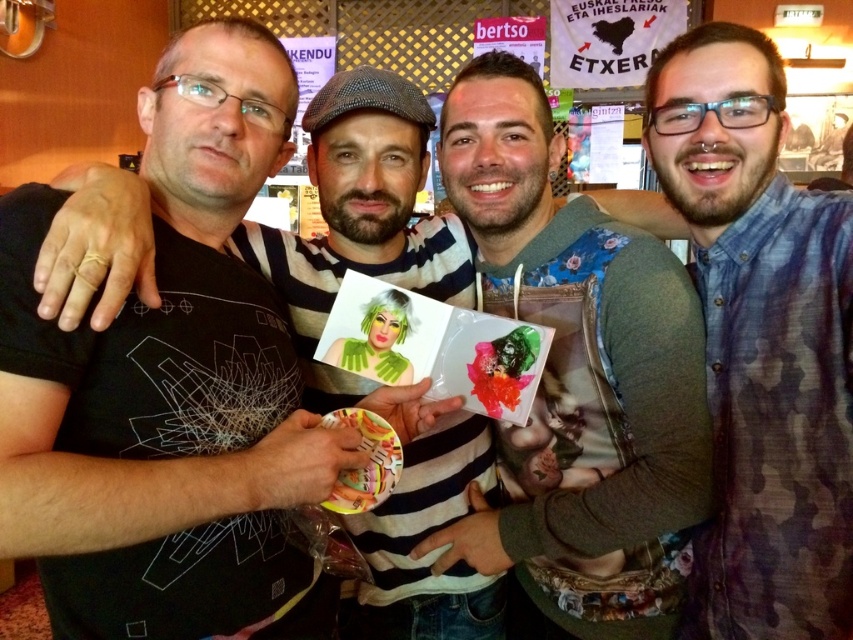
Is black matte t-shirt at center positioned in front of blue camouflage shirt at center?

Yes.

From the picture: Is black matte t-shirt at center bigger than blue camouflage shirt at center?

Indeed, black matte t-shirt at center has a larger size compared to blue camouflage shirt at center.

What do you see at coordinates (169, 388) in the screenshot?
I see `black matte t-shirt at center` at bounding box center [169, 388].

Where is `black matte t-shirt at center`? The width and height of the screenshot is (853, 640). black matte t-shirt at center is located at coordinates (169, 388).

Does floral-patterned hoodie at center appear under blue camouflage shirt at center?

Correct, floral-patterned hoodie at center is located below blue camouflage shirt at center.

Does point (496, 116) come farther from viewer compared to point (683, 84)?

Yes, it is behind point (683, 84).

The height and width of the screenshot is (640, 853). In order to click on floral-patterned hoodie at center in this screenshot , I will do `click(577, 381)`.

Does black matte t-shirt at center appear over floral-patterned hoodie at center?

Yes, black matte t-shirt at center is above floral-patterned hoodie at center.

Locate an element on the screen. The width and height of the screenshot is (853, 640). black matte t-shirt at center is located at coordinates (169, 388).